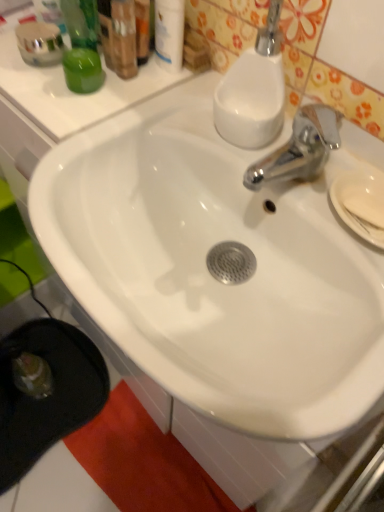
Question: Should I look upward or downward to see white glossy sink at center?

Choices:
 (A) down
 (B) up

Answer: (B)

Question: Is green matte jar at upper left taller than white glossy lotion at upper center?

Choices:
 (A) yes
 (B) no

Answer: (B)

Question: Considering the relative positions of green matte jar at upper left and white glossy lotion at upper center in the image provided, is green matte jar at upper left behind white glossy lotion at upper center?

Choices:
 (A) yes
 (B) no

Answer: (A)

Question: From a real-world perspective, is green matte jar at upper left beneath white glossy lotion at upper center?

Choices:
 (A) yes
 (B) no

Answer: (A)

Question: Is white glossy lotion at upper center completely or partially inside green matte jar at upper left?

Choices:
 (A) no
 (B) yes

Answer: (A)

Question: Is the position of green matte jar at upper left less distant than that of white glossy lotion at upper center?

Choices:
 (A) no
 (B) yes

Answer: (A)

Question: Is green matte jar at upper left bigger than white glossy lotion at upper center?

Choices:
 (A) no
 (B) yes

Answer: (A)

Question: Is white matte soap at right in front of white glossy lotion at upper center?

Choices:
 (A) yes
 (B) no

Answer: (A)

Question: From a real-world perspective, is white matte soap at right below white glossy lotion at upper center?

Choices:
 (A) no
 (B) yes

Answer: (B)

Question: Considering the relative sizes of white matte soap at right and white glossy lotion at upper center in the image provided, is white matte soap at right bigger than white glossy lotion at upper center?

Choices:
 (A) yes
 (B) no

Answer: (B)

Question: Is white matte soap at right smaller than white glossy lotion at upper center?

Choices:
 (A) no
 (B) yes

Answer: (B)

Question: Are white matte soap at right and white glossy lotion at upper center located far from each other?

Choices:
 (A) yes
 (B) no

Answer: (B)

Question: Is white matte soap at right wider than white glossy lotion at upper center?

Choices:
 (A) no
 (B) yes

Answer: (B)

Question: From a real-world perspective, is white glossy soap dispenser at upper right beneath white glossy lotion at upper center?

Choices:
 (A) yes
 (B) no

Answer: (B)